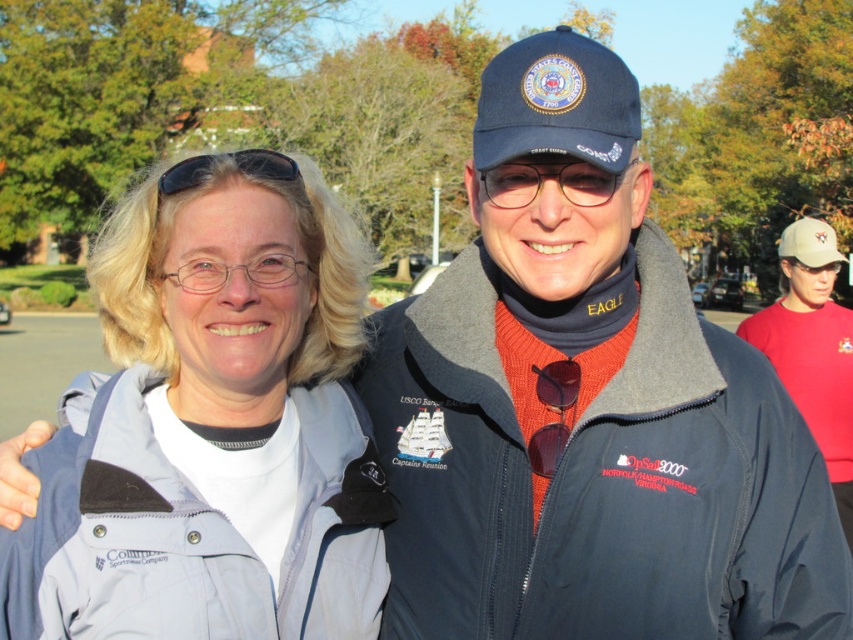
Which is below, gray fabric jacket at left or black rubber goggles at upper center?

Positioned lower is gray fabric jacket at left.

Between gray fabric jacket at left and black rubber goggles at upper center, which one appears on the left side from the viewer's perspective?

gray fabric jacket at left

Is point (322, 449) farther from camera compared to point (253, 170)?

Yes, point (322, 449) is behind point (253, 170).

At what (x,y) coordinates should I click in order to perform the action: click on gray fabric jacket at left. Please return your answer as a coordinate pair (x, y). The width and height of the screenshot is (853, 640). Looking at the image, I should click on (212, 428).

Measure the distance from clear plastic glasses at center to black rubber goggles at upper center.

clear plastic glasses at center and black rubber goggles at upper center are 22.42 inches apart.

Is point (546, 157) positioned in front of point (245, 163)?

Yes, point (546, 157) is closer to viewer.

Where is `clear plastic glasses at center`? This screenshot has height=640, width=853. clear plastic glasses at center is located at coordinates (547, 177).

Does gray fabric jacket at left have a greater width compared to clear plastic glasses at center?

Indeed, gray fabric jacket at left has a greater width compared to clear plastic glasses at center.

Is gray fabric jacket at left in front of clear plastic glasses at center?

Yes, it is.

From the picture: Who is more distant from viewer, (67, 589) or (483, 184)?

The point (483, 184) is more distant.

Where is `gray fabric jacket at left`? gray fabric jacket at left is located at coordinates (212, 428).